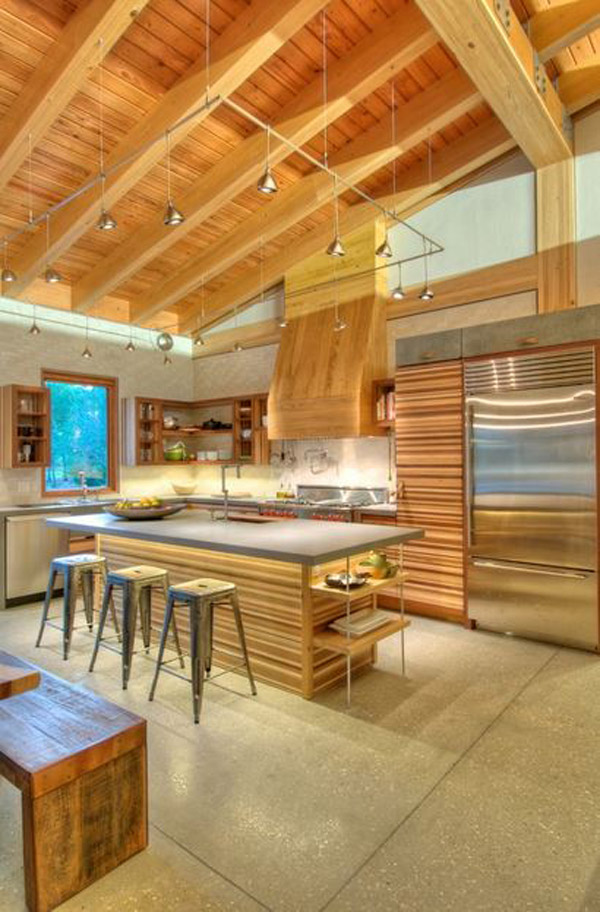
You are a GUI agent. You are given a task and a screenshot of the screen. Output one action in this format:
    pyautogui.click(x=<x>, y=<y>)
    Task: Click on the stools
    The image size is (600, 912).
    Given the screenshot: What is the action you would take?
    pyautogui.click(x=176, y=602), pyautogui.click(x=129, y=596), pyautogui.click(x=50, y=563)